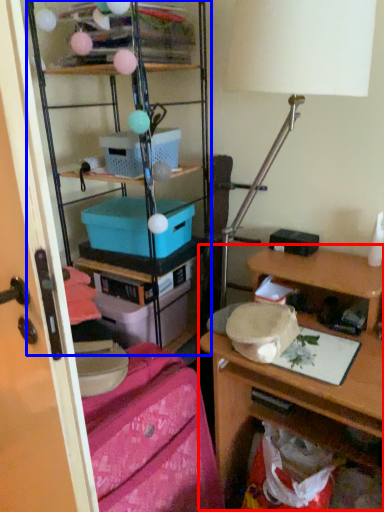
Question: Which of the following is the closest to the observer, desk (highlighted by a red box) or shelf (highlighted by a blue box)?

Choices:
 (A) desk
 (B) shelf

Answer: (A)